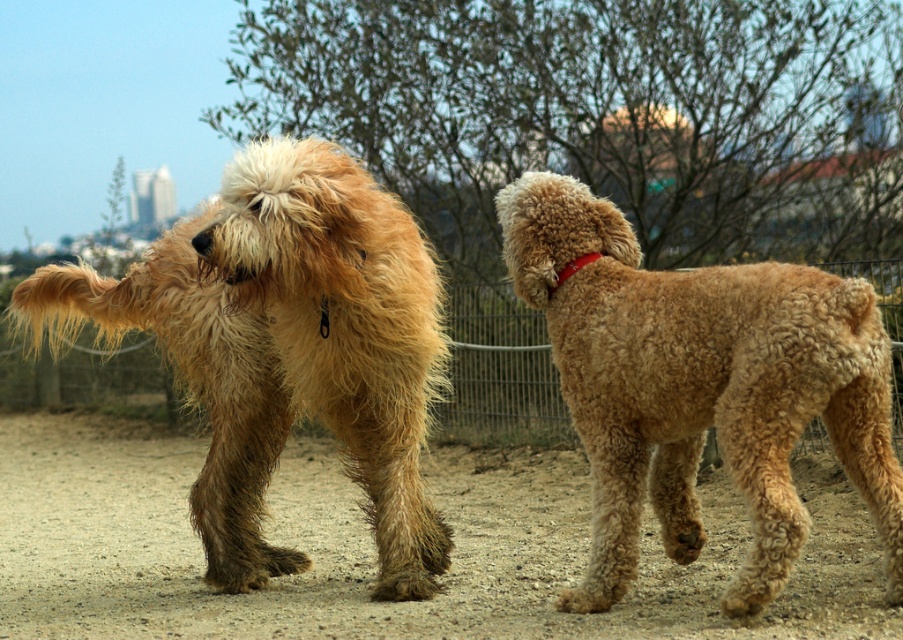
Between point (668, 627) and point (342, 294), which one is positioned in front?

Point (668, 627) is more forward.

The height and width of the screenshot is (640, 903). I want to click on brown sandy ground at center, so click(375, 552).

Can you confirm if golden curly fur dog at center is wider than red leather collar at upper right?

Indeed, golden curly fur dog at center has a greater width compared to red leather collar at upper right.

In order to click on golden curly fur dog at center in this screenshot , I will do `click(700, 387)`.

Find the location of `golden curly fur dog at center`. golden curly fur dog at center is located at coordinates (700, 387).

Is point (719, 477) closer to viewer compared to point (559, 276)?

No, (719, 477) is behind (559, 276).

Does brown sandy ground at center appear on the right side of red leather collar at upper right?

Incorrect, brown sandy ground at center is not on the right side of red leather collar at upper right.

Find the location of a particular element. The height and width of the screenshot is (640, 903). brown sandy ground at center is located at coordinates (375, 552).